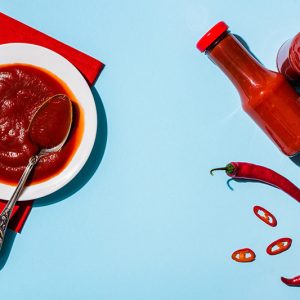
Locate an element on the screen. This screenshot has height=300, width=300. plate is located at coordinates (17, 53), (49, 64), (75, 89), (83, 140), (60, 183), (10, 188).